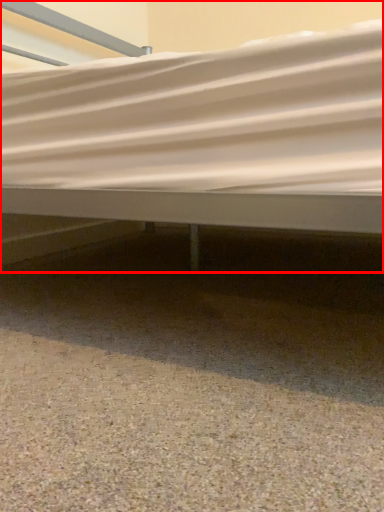
Question: From the image's perspective, what is the correct spatial relationship of bed (annotated by the red box) in relation to gravel?

Choices:
 (A) above
 (B) below

Answer: (A)